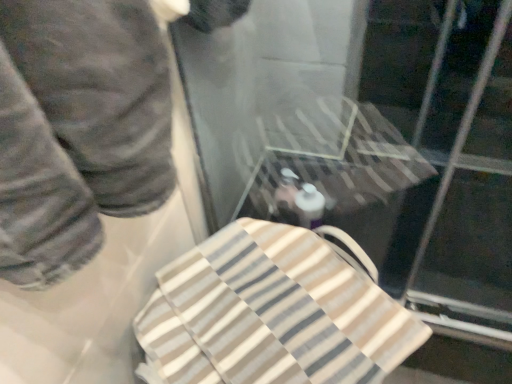
Question: Is dark gray pants at left to the right of beige striped towel at center from the viewer's perspective?

Choices:
 (A) no
 (B) yes

Answer: (A)

Question: From a real-world perspective, is dark gray pants at left located higher than beige striped towel at center?

Choices:
 (A) no
 (B) yes

Answer: (B)

Question: Is dark gray pants at left thinner than beige striped towel at center?

Choices:
 (A) yes
 (B) no

Answer: (A)

Question: Is dark gray pants at left aimed at beige striped towel at center?

Choices:
 (A) yes
 (B) no

Answer: (B)

Question: Is dark gray pants at left facing away from beige striped towel at center?

Choices:
 (A) yes
 (B) no

Answer: (B)

Question: Is beige striped towel at center taller or shorter than dark gray pants at left?

Choices:
 (A) short
 (B) tall

Answer: (A)

Question: Considering the positions of beige striped towel at center and dark gray pants at left in the image, is beige striped towel at center bigger or smaller than dark gray pants at left?

Choices:
 (A) small
 (B) big

Answer: (B)

Question: Considering their positions, is beige striped towel at center located in front of or behind dark gray pants at left?

Choices:
 (A) behind
 (B) front

Answer: (A)

Question: From a real-world perspective, is beige striped towel at center above or below dark gray pants at left?

Choices:
 (A) below
 (B) above

Answer: (A)

Question: Is transparent plastic glass door at upper center taller or shorter than beige striped towel at center?

Choices:
 (A) short
 (B) tall

Answer: (A)

Question: Is point (384, 8) closer or farther from the camera than point (217, 372)?

Choices:
 (A) farther
 (B) closer

Answer: (A)

Question: Which is correct: transparent plastic glass door at upper center is inside beige striped towel at center, or outside of it?

Choices:
 (A) inside
 (B) outside

Answer: (B)

Question: Considering the positions of transparent plastic glass door at upper center and beige striped towel at center in the image, is transparent plastic glass door at upper center wider or thinner than beige striped towel at center?

Choices:
 (A) thin
 (B) wide

Answer: (B)

Question: From a real-world perspective, is beige striped towel at center above or below transparent plastic glass door at upper center?

Choices:
 (A) above
 (B) below

Answer: (A)

Question: Looking at their shapes, would you say beige striped towel at center is wider or thinner than transparent plastic glass door at upper center?

Choices:
 (A) wide
 (B) thin

Answer: (B)